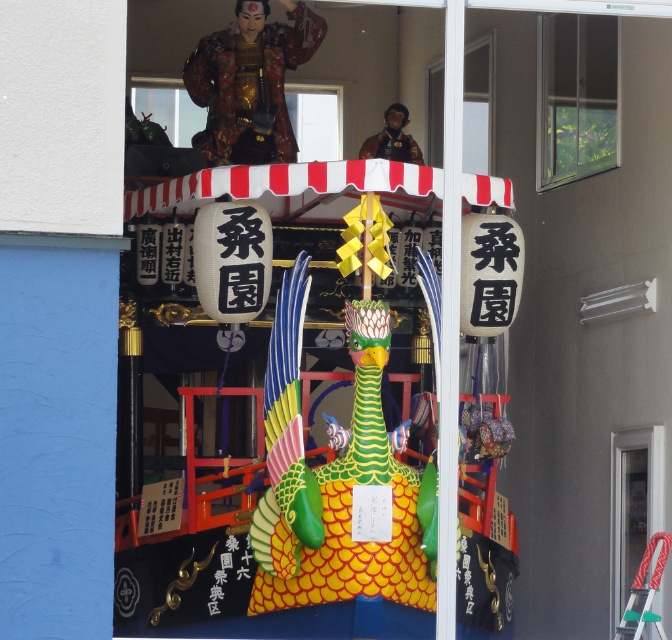
You are standing in front of a traditional Japanese festival float. You see a transparent glass door at right and a transparent glass window at upper center. Which object is located below the other?

The transparent glass door at right is positioned under the transparent glass window at upper center.